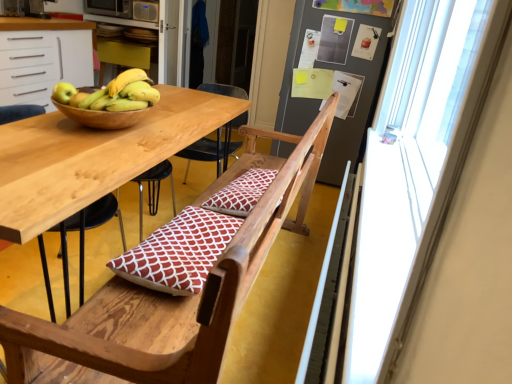
Question: In the image, is transparent glass window at right positioned in front of or behind metallic microwave at upper left?

Choices:
 (A) behind
 (B) front

Answer: (B)

Question: In terms of height, does transparent glass window at right look taller or shorter compared to metallic microwave at upper left?

Choices:
 (A) short
 (B) tall

Answer: (B)

Question: Considering the real-world distances, which object is closest to the yellow matte bananas at upper left?

Choices:
 (A) wooden chair at center
 (B) green matte apple at upper left
 (C) transparent plastic screen door at upper center
 (D) white patterned cushion at center
 (E) red printed cushion at center

Answer: (B)

Question: Considering the real-world distances, which object is farthest from the transparent plastic screen door at upper center?

Choices:
 (A) metallic microwave at upper left
 (B) matte white cabinet at upper left
 (C) white patterned cushion at center
 (D) yellow matte bananas at upper left
 (E) transparent glass window at right

Answer: (D)